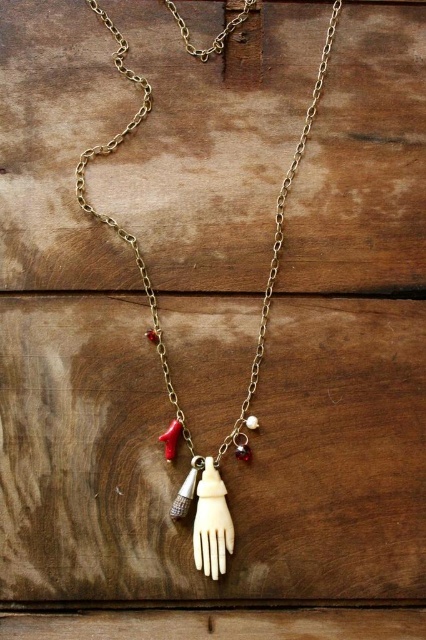
Question: Is the position of matte silver charm at center more distant than that of pearl-like bone hand at center?

Choices:
 (A) yes
 (B) no

Answer: (B)

Question: Does bone/carved hand at center come in front of pearl-like bone hand at center?

Choices:
 (A) yes
 (B) no

Answer: (A)

Question: Which of the following is the farthest from the observer?

Choices:
 (A) (178, 490)
 (B) (328, 38)
 (C) (233, 436)

Answer: (C)

Question: Observing the image, what is the correct spatial positioning of bone/carved hand at center in reference to matte silver charm at center?

Choices:
 (A) right
 (B) left

Answer: (A)

Question: Among these points, which one is farthest from the camera?

Choices:
 (A) (242, 451)
 (B) (104, 150)
 (C) (189, 481)

Answer: (A)

Question: Estimate the real-world distances between objects in this image. Which object is closer to the matte silver charm at center?

Choices:
 (A) pearl-like bone hand at center
 (B) bone/carved hand at center

Answer: (A)